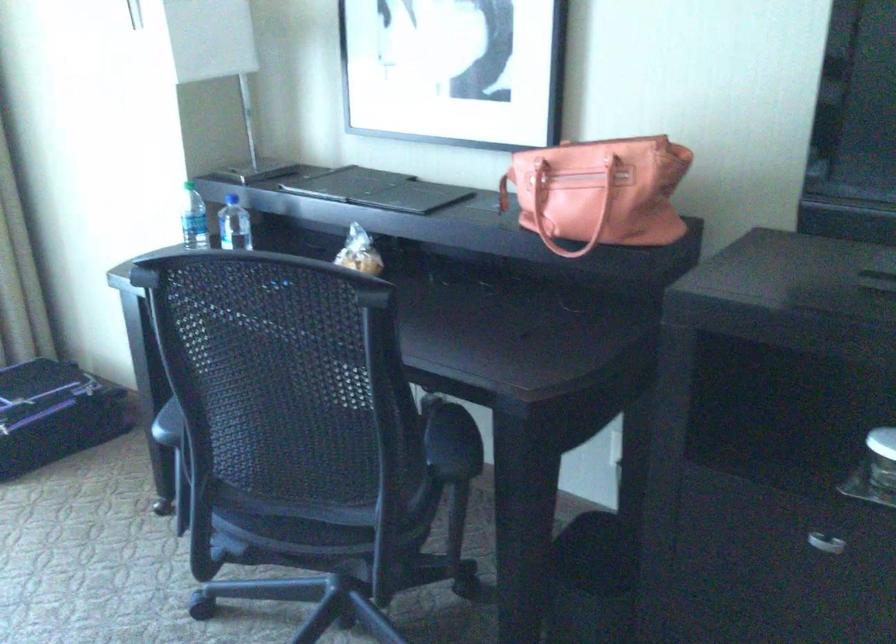
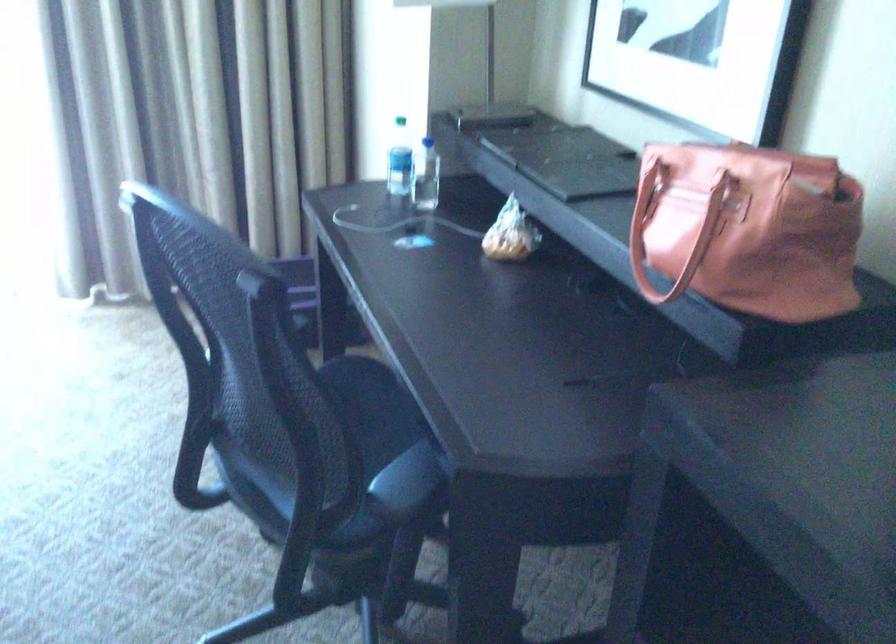
Question: How did the camera likely rotate?

Choices:
 (A) Left
 (B) Right
 (C) Up
 (D) Down

Answer: (A)